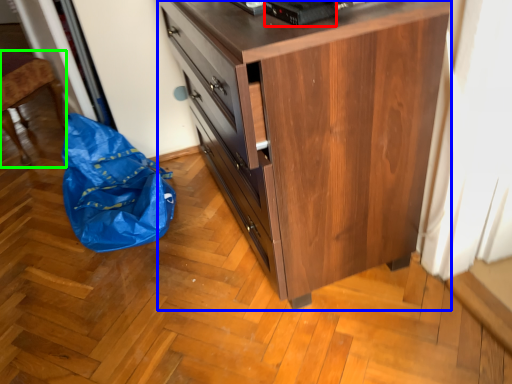
Question: Which is farther away from appliance (highlighted by a red box)? chest of drawers (highlighted by a blue box) or furniture (highlighted by a green box)?

Choices:
 (A) chest of drawers
 (B) furniture

Answer: (B)